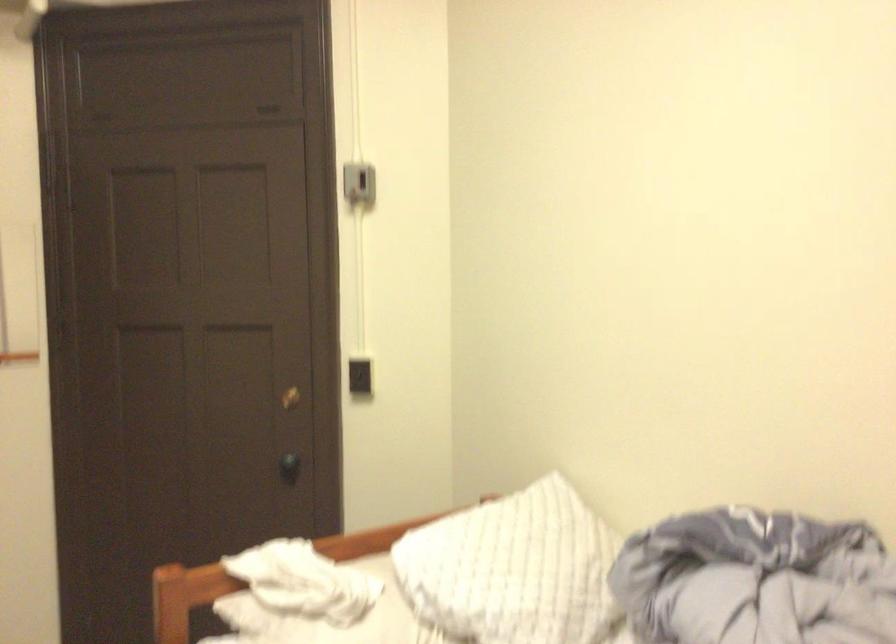
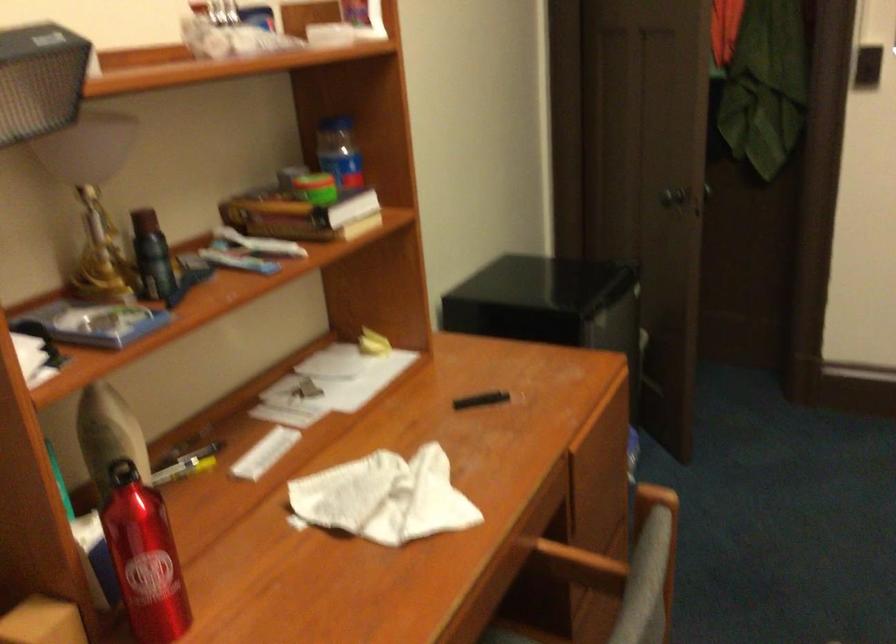
The images are taken continuously from a first-person perspective. In which direction is your viewpoint rotating?

The rotation direction of the camera is left-down.